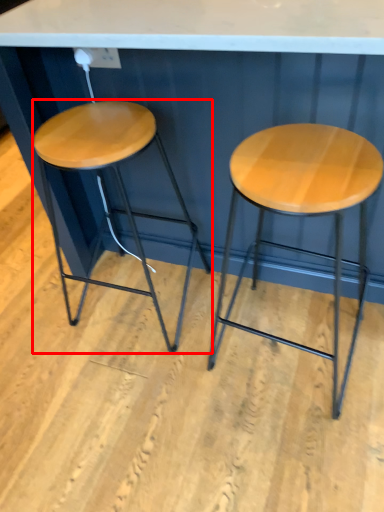
Question: Observing the image, what is the correct spatial positioning of stool (annotated by the red box) in reference to stool?

Choices:
 (A) right
 (B) left

Answer: (B)